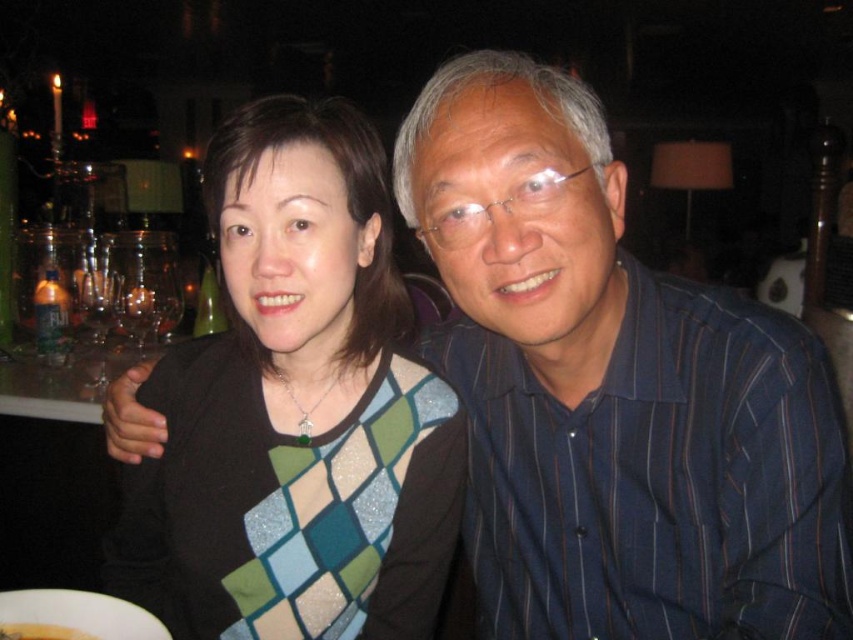
You are a waiter at this restaurant and need to place a 12cm diameter dessert plate on the matte glass table at lower left. Can you confirm if there is enough space for it?

The matte glass table at lower left has a diameter of 12cm, so the dessert plate will fit perfectly.

You are a waiter trying to place a banana on the table for the customers. Based on the scene, can the yellow smooth banana at lower left fit on the matte glass table at lower left?

The matte glass table at lower left is bigger than the yellow smooth banana at lower left, so yes, the banana can fit on the table.

You are a photographer adjusting the camera focus. You need to ensure both the blue striped shirt at center and the matte black sweater at center are in focus. Given their sizes, which one should you adjust the focus towards first?

The blue striped shirt at center is larger than the matte black sweater at center, so you should adjust the focus towards the blue striped shirt at center first to ensure both are in focus.